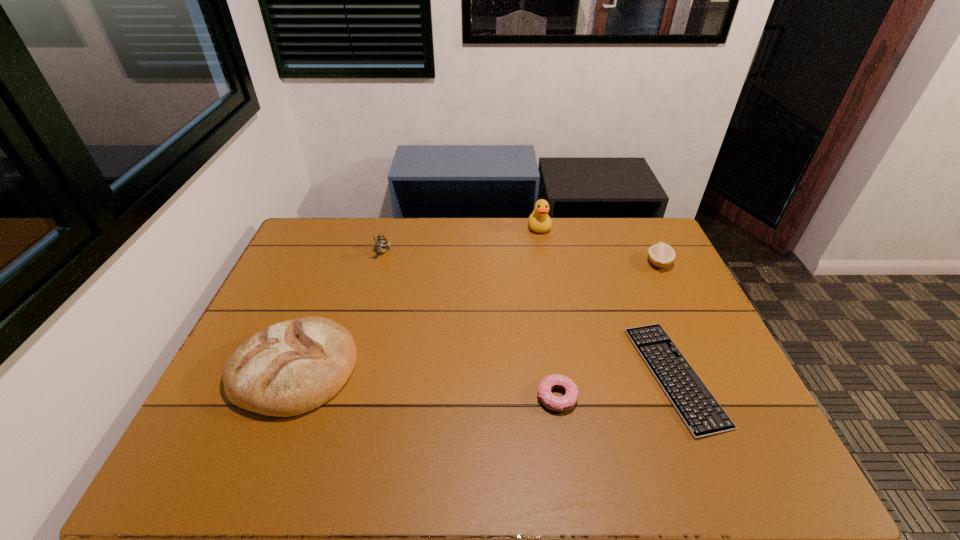
This screenshot has width=960, height=540. In order to click on the tallest object in this screenshot , I will do `click(539, 221)`.

Identify the location of duck. (539, 221).

I want to click on snail, so click(x=381, y=243).

Locate an element on the screen. Image resolution: width=960 pixels, height=540 pixels. bread is located at coordinates (292, 367).

Identify the location of lemon. This screenshot has width=960, height=540. (661, 255).

Where is `the second shortest object`? The image size is (960, 540). the second shortest object is located at coordinates (555, 403).

At what (x,y) coordinates should I click in order to perform the action: click on computer keyboard. Please return your answer as a coordinate pair (x, y). Image resolution: width=960 pixels, height=540 pixels. Looking at the image, I should click on (700, 411).

Identify the location of vacant space situated at the beak of the tallest object. (555, 315).

Find the location of a particular element. free space located 0.370m on the face of the snail is located at coordinates (357, 346).

Where is `vacant area situated 0.070m on the right of the bread`? vacant area situated 0.070m on the right of the bread is located at coordinates (383, 368).